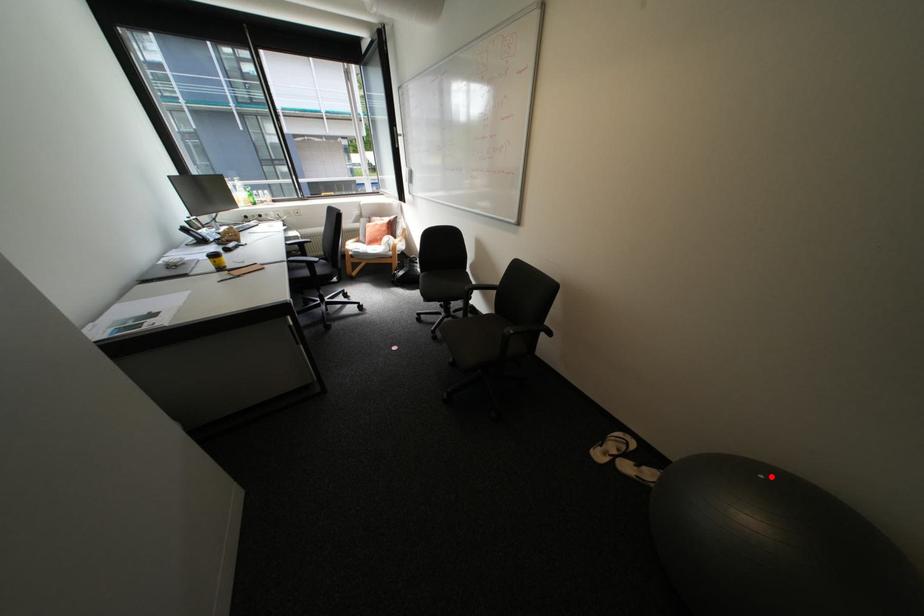
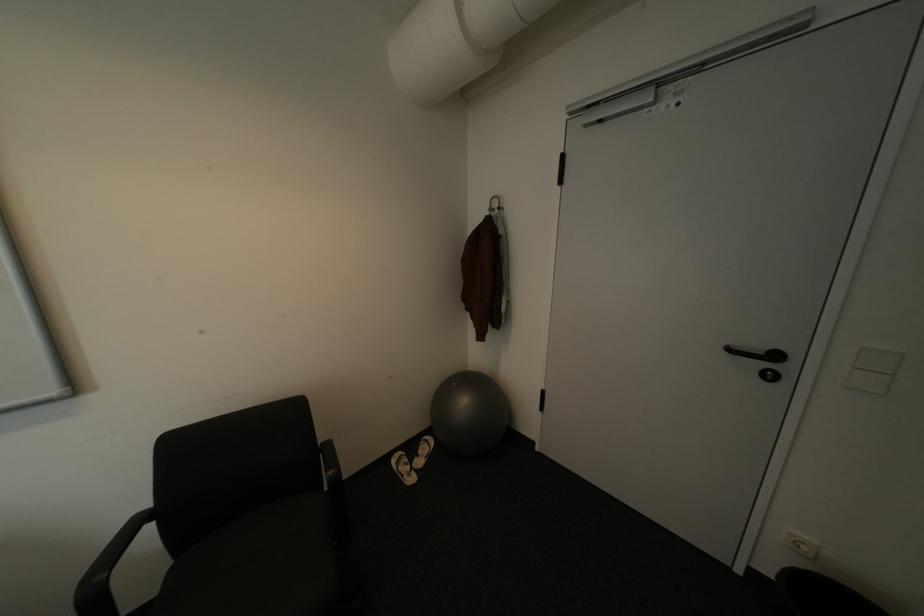
In the second image, find the point that corresponds to the highlighted location in the first image.

(464, 384)